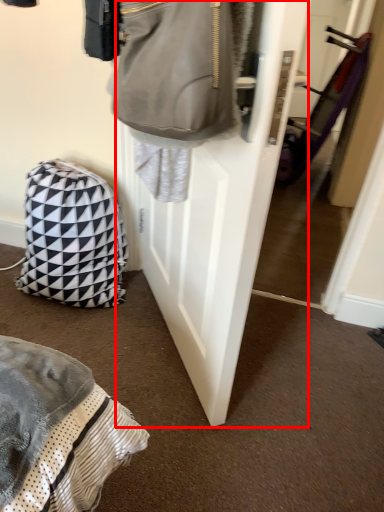
Question: From the image's perspective, what is the correct spatial positioning of door (annotated by the red box) in reference to backpack?

Choices:
 (A) below
 (B) above

Answer: (B)